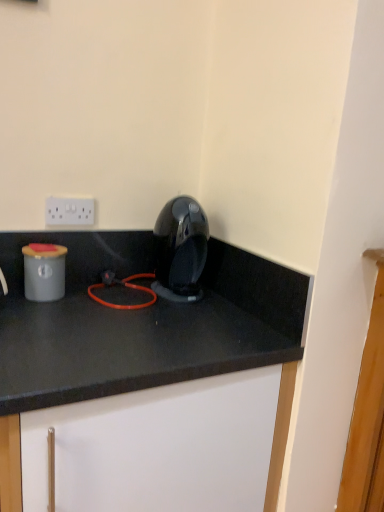
Where is `free space in front of matte gray container at left`? This screenshot has width=384, height=512. free space in front of matte gray container at left is located at coordinates (39, 315).